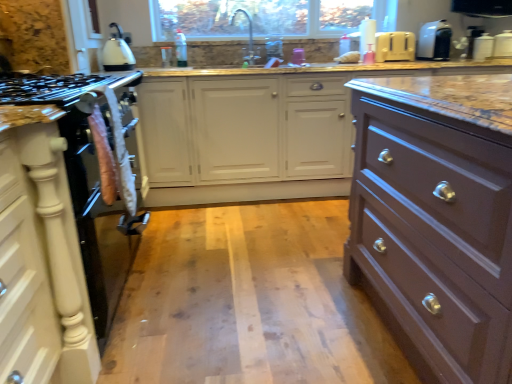
Question: From a real-world perspective, is white matte cabinet at left physically below marble countertop at center?

Choices:
 (A) no
 (B) yes

Answer: (B)

Question: Is white matte cabinet at left shorter than marble countertop at center?

Choices:
 (A) no
 (B) yes

Answer: (B)

Question: Can you see white matte cabinet at left touching marble countertop at center?

Choices:
 (A) yes
 (B) no

Answer: (B)

Question: Is white matte cabinet at left far from marble countertop at center?

Choices:
 (A) no
 (B) yes

Answer: (B)

Question: Can you confirm if white matte cabinet at left is bigger than marble countertop at center?

Choices:
 (A) yes
 (B) no

Answer: (B)

Question: Choose the correct answer: Is satin brown drawer at right inside white matte cabinet at left or outside it?

Choices:
 (A) inside
 (B) outside

Answer: (B)

Question: In the image, is satin brown drawer at right on the left side or the right side of white matte cabinet at left?

Choices:
 (A) left
 (B) right

Answer: (B)

Question: Does point (450, 215) appear closer or farther from the camera than point (51, 301)?

Choices:
 (A) closer
 (B) farther

Answer: (A)

Question: From the image's perspective, is satin brown drawer at right above or below white matte cabinet at left?

Choices:
 (A) below
 (B) above

Answer: (B)

Question: In the image, is satin brown drawer at right on the left side or the right side of satin nickel faucet at upper center?

Choices:
 (A) right
 (B) left

Answer: (A)

Question: Is satin brown drawer at right wider or thinner than satin nickel faucet at upper center?

Choices:
 (A) thin
 (B) wide

Answer: (B)

Question: Considering the positions of satin brown drawer at right and satin nickel faucet at upper center in the image, is satin brown drawer at right bigger or smaller than satin nickel faucet at upper center?

Choices:
 (A) small
 (B) big

Answer: (B)

Question: Considering their positions, is satin brown drawer at right located in front of or behind satin nickel faucet at upper center?

Choices:
 (A) behind
 (B) front

Answer: (B)

Question: Considering the positions of white plastic toaster at upper right, the 4th appliance positioned from the right, and satin brown drawer at right in the image, is white plastic toaster at upper right, the 4th appliance positioned from the right, wider or thinner than satin brown drawer at right?

Choices:
 (A) thin
 (B) wide

Answer: (A)

Question: Based on their sizes in the image, would you say white plastic toaster at upper right, the 4th appliance positioned from the right, is bigger or smaller than satin brown drawer at right?

Choices:
 (A) small
 (B) big

Answer: (A)